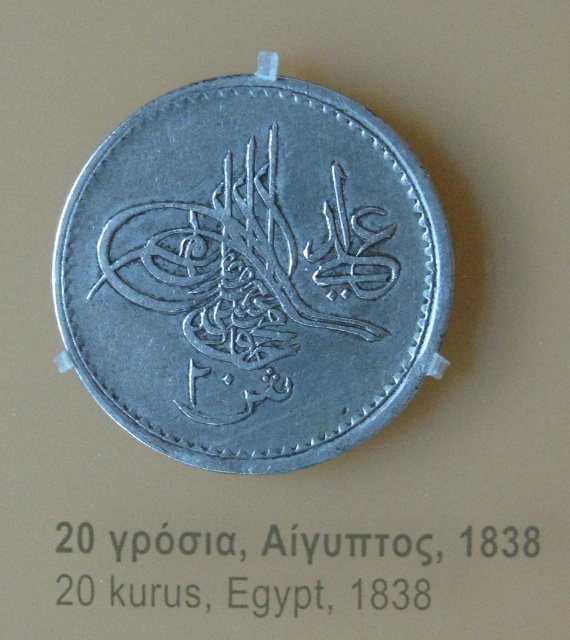
Question: Which of the following is the farthest from the observer?

Choices:
 (A) silver metallic coin at center
 (B) black metallic text at center

Answer: (B)

Question: Is silver metallic coin at center to the right of black metallic text at center from the viewer's perspective?

Choices:
 (A) no
 (B) yes

Answer: (A)

Question: Which object appears farthest from the camera in this image?

Choices:
 (A) silver metallic coin at center
 (B) black metallic text at center

Answer: (B)

Question: Which object appears closest to the camera in this image?

Choices:
 (A) black metallic text at center
 (B) silver metallic coin at center

Answer: (B)

Question: Is silver metallic coin at center wider than black metallic text at center?

Choices:
 (A) no
 (B) yes

Answer: (A)

Question: Does silver metallic coin at center have a larger size compared to black metallic text at center?

Choices:
 (A) yes
 (B) no

Answer: (A)